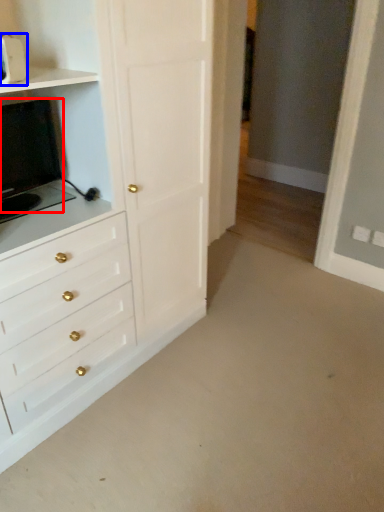
Question: Which object is further to the camera taking this photo, appliance (highlighted by a red box) or appliance (highlighted by a blue box)?

Choices:
 (A) appliance
 (B) appliance

Answer: (A)